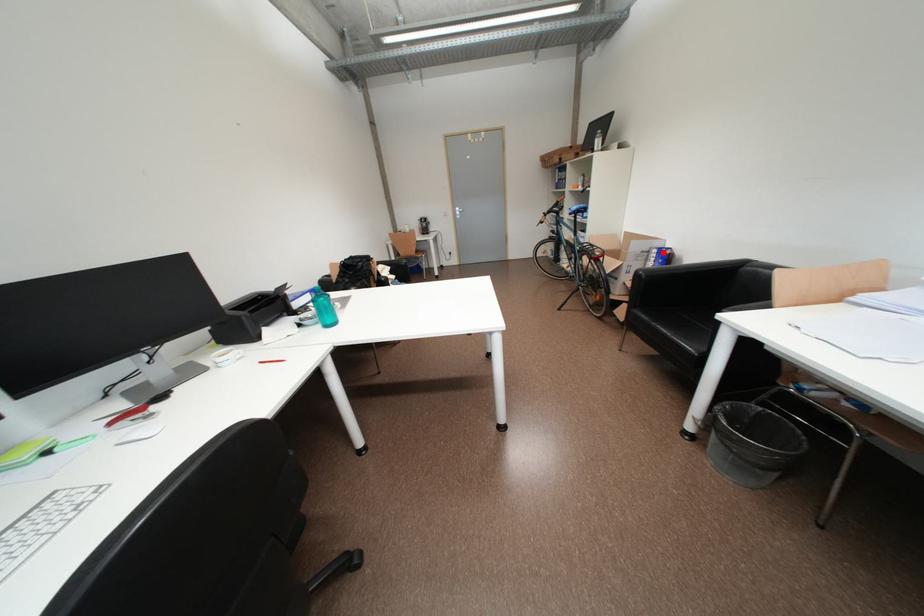
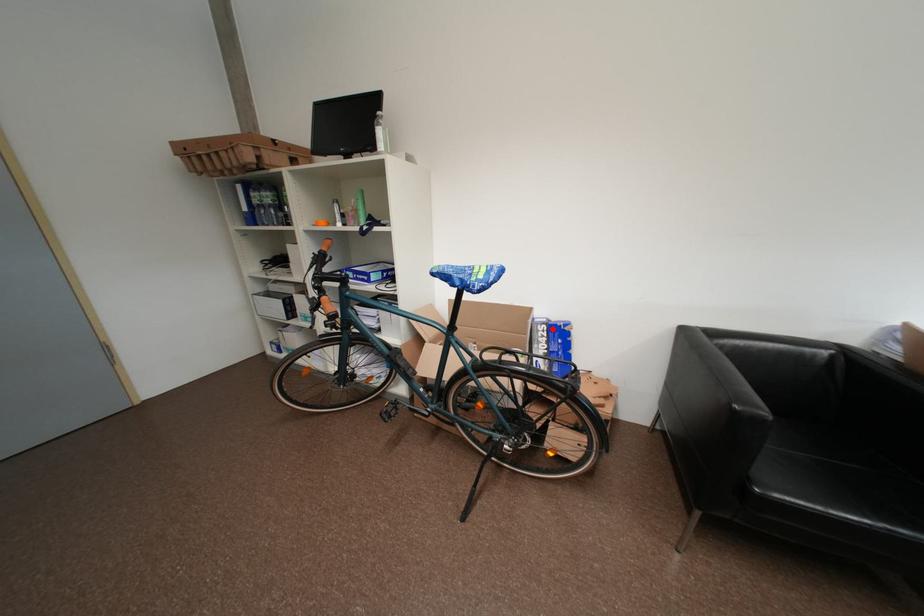
I am providing you with two images of the same scene from different viewpoints. A red point is marked on the first image and another point is marked on the second image. Is the red point in image1 aligned with the point shown in image2?

Yes